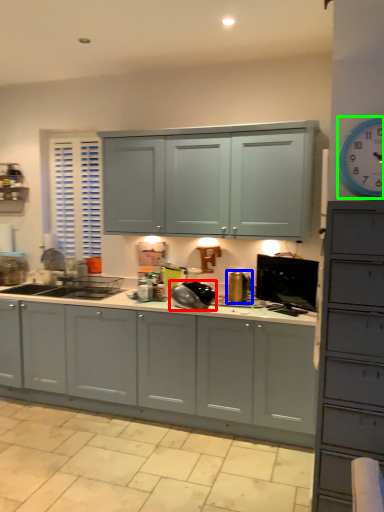
Question: Which is farther away from appliance (highlighted by a red box)? appliance (highlighted by a blue box) or clock (highlighted by a green box)?

Choices:
 (A) appliance
 (B) clock

Answer: (B)